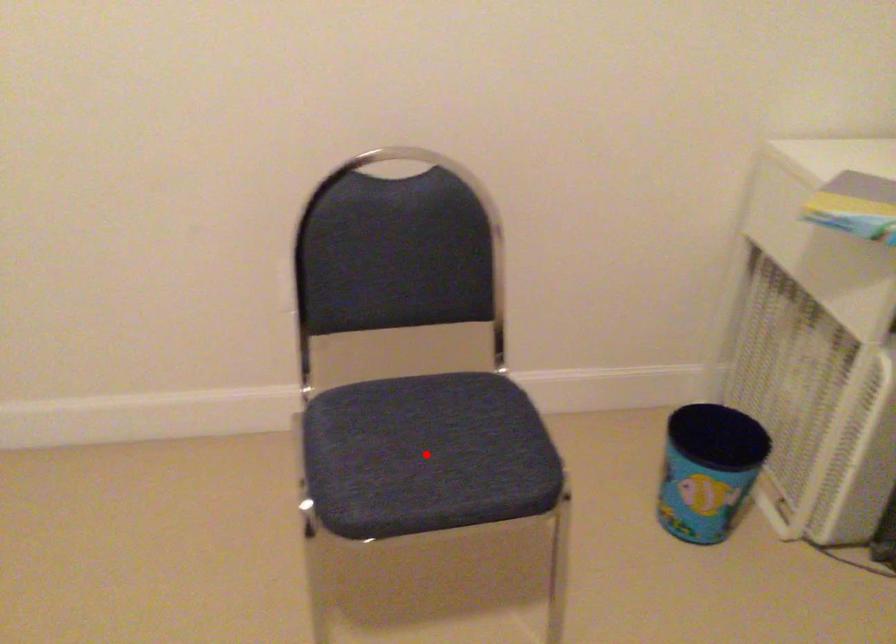
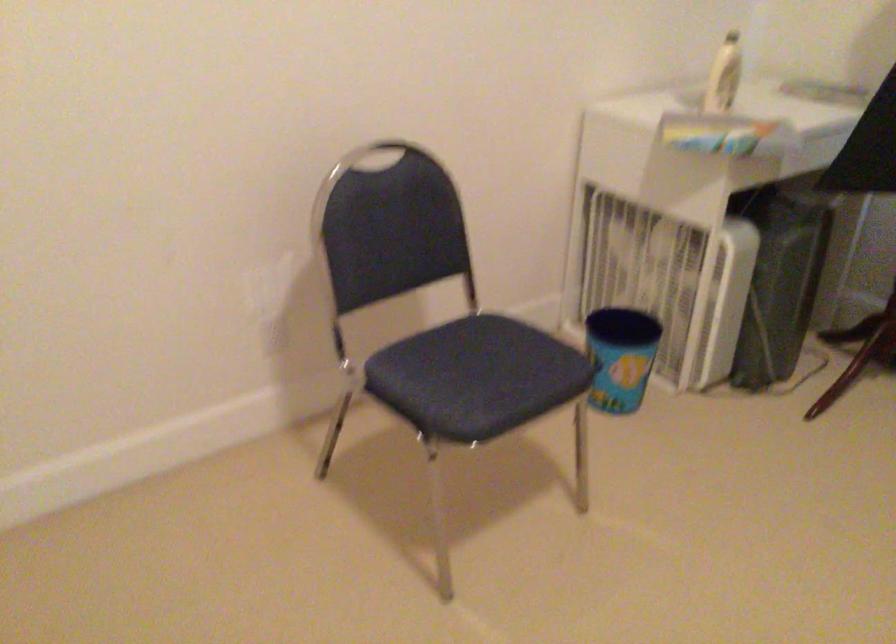
Find the pixel in the second image that matches the highlighted location in the first image.

(476, 377)